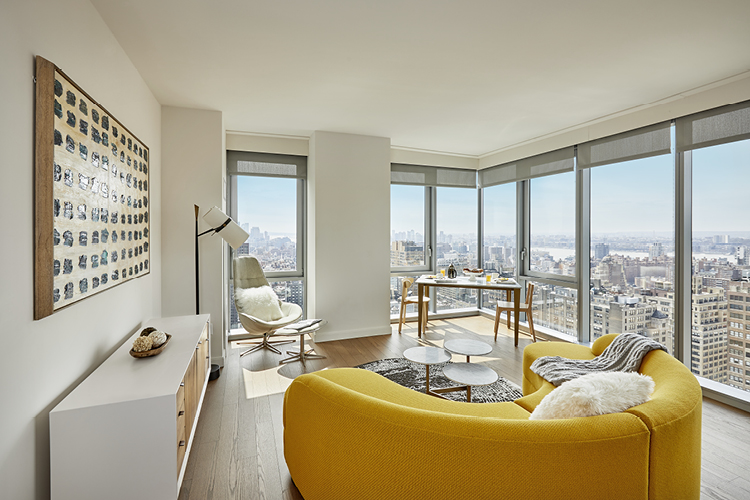
This screenshot has width=750, height=500. In order to click on stand in this screenshot , I will do `click(136, 406)`.